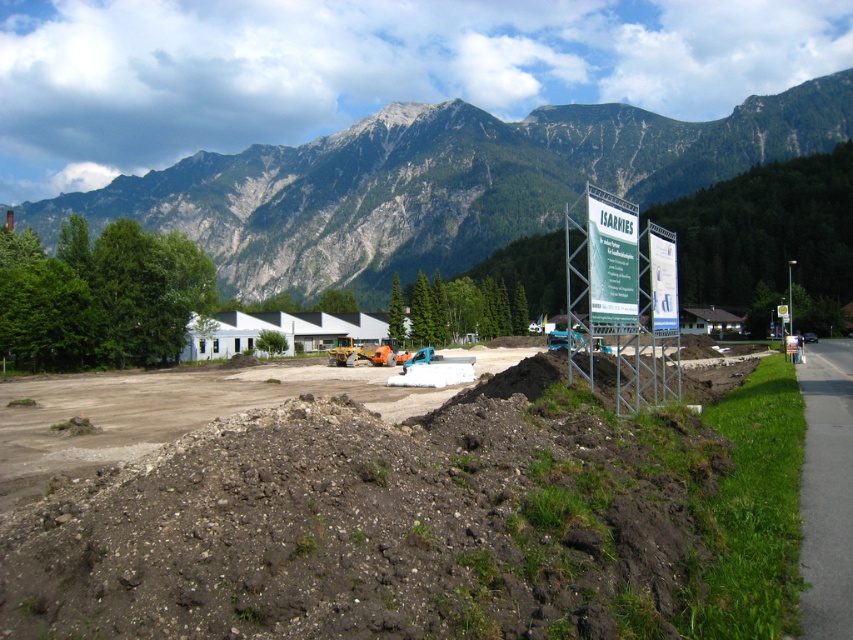
You are a surveyor at the construction site. You need to determine which object is lower in height between the brown soil at center and the rocky gray mountain at upper center. Based on the scene, which one is lower?

The brown soil at center is shorter than the rocky gray mountain at upper center, so the brown soil at center is lower in height.

You are a construction worker who needs to place a 1 meter by 1 meter wooden box on the brown soil at center. Based on the coordinates provided, can you determine if the box will fit on the soil?

The brown soil at center is located at point [379,524], so the box can be placed there as the coordinates indicate a specific location on the soil.